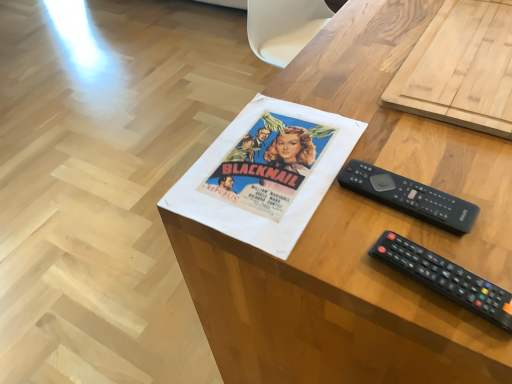
Locate an element on the screen. vacant area that is situated to the right of black plastic remote at center right, the 1th remote control when ordered from back to front is located at coordinates (466, 178).